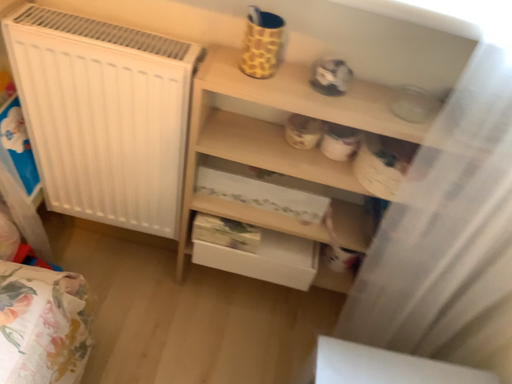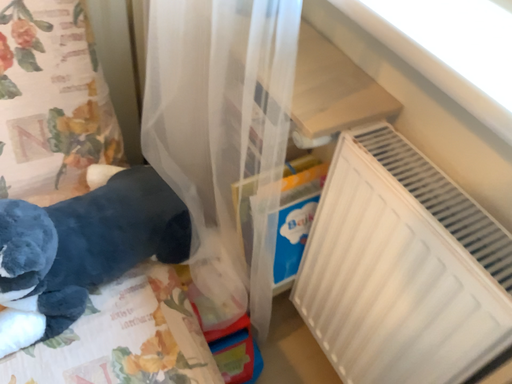
Question: Which way did the camera rotate in the video?

Choices:
 (A) rotated upward
 (B) rotated downward

Answer: (A)